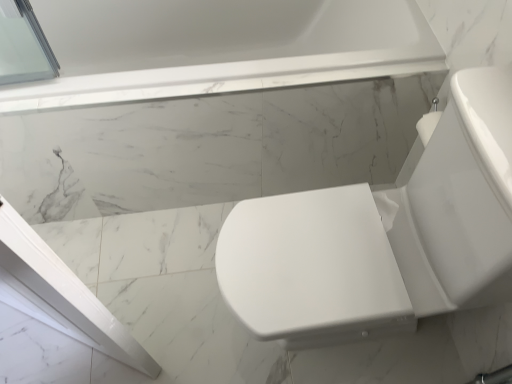
Question: Considering the positions of white glossy toilet at right and white marble bathtub at upper center in the image, is white glossy toilet at right wider or thinner than white marble bathtub at upper center?

Choices:
 (A) thin
 (B) wide

Answer: (B)

Question: Is white glossy toilet at right bigger or smaller than white marble bathtub at upper center?

Choices:
 (A) big
 (B) small

Answer: (B)

Question: From a real-world perspective, is white glossy toilet at right physically located above or below white marble bathtub at upper center?

Choices:
 (A) above
 (B) below

Answer: (A)

Question: Would you say white marble bathtub at upper center is inside or outside white glossy toilet at right?

Choices:
 (A) inside
 (B) outside

Answer: (B)

Question: Is white marble bathtub at upper center taller or shorter than white glossy toilet at right?

Choices:
 (A) tall
 (B) short

Answer: (B)

Question: Relative to white glossy toilet at right, is white marble bathtub at upper center in front or behind?

Choices:
 (A) front
 (B) behind

Answer: (B)

Question: Based on their positions, is white marble bathtub at upper center located to the left or right of white glossy toilet at right?

Choices:
 (A) right
 (B) left

Answer: (B)